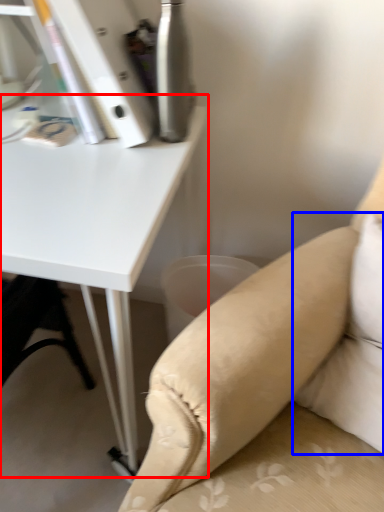
Question: Which object is closer to the camera taking this photo, table (highlighted by a red box) or pillow (highlighted by a blue box)?

Choices:
 (A) table
 (B) pillow

Answer: (B)